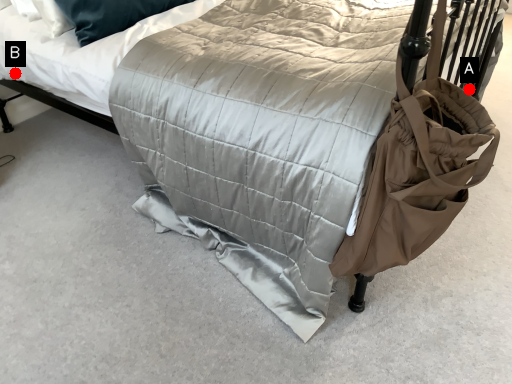
Question: Two points are circled on the image, labeled by A and B beside each circle. Which point is further to the camera?

Choices:
 (A) A is further
 (B) B is further

Answer: (A)